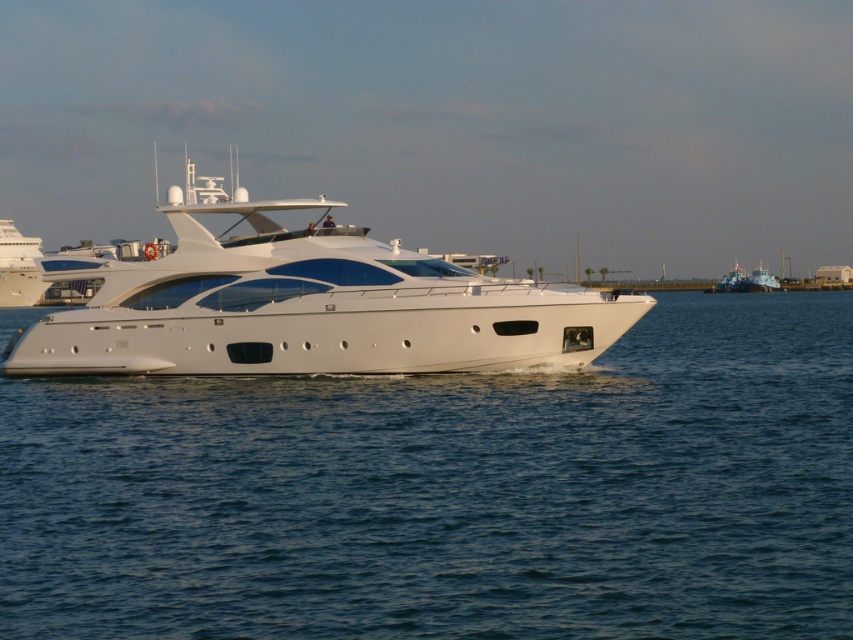
You are standing on the deck of the yacht and notice a point marked at coordinates (651, 362). If you want to throw a lifebuoy to someone exactly 50 meters away from you, will the point be within reach?

The point at (651, 362) is only 45.68 meters away from the viewer, so the lifebuoy can reach it since it is closer than 50 meters.

You are navigating a drone that needs to take a photo of the white glossy yacht at center. The drone must avoid obstacles and maintain a safe distance. Given the yacht is at coordinates point 0.477, 0.358, can you confirm the yacht is positioned centrally within the frame?

The white glossy yacht at center is located at point (x=305, y=305), which is centrally positioned within the frame.

What are the coordinates of the clear blue water at center?

The clear blue water at center is located at point (450, 493).